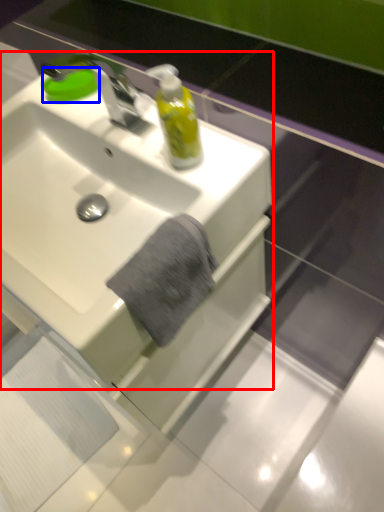
Question: Which point is further to the camera, sink (highlighted by a red box) or soap (highlighted by a blue box)?

Choices:
 (A) sink
 (B) soap

Answer: (B)